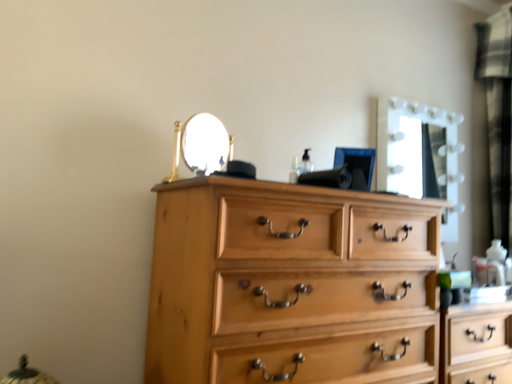
Question: Considering the positions of point (499, 228) and point (292, 251), is point (499, 228) closer or farther from the camera than point (292, 251)?

Choices:
 (A) closer
 (B) farther

Answer: (B)

Question: From their relative heights in the image, would you say black textured curtain at right is taller or shorter than natural wood chest of drawers at center?

Choices:
 (A) short
 (B) tall

Answer: (B)

Question: Based on their relative distances, which object is nearer to the black textured curtain at right?

Choices:
 (A) natural wood chest of drawers at center
 (B) white glossy mirror at upper right

Answer: (B)

Question: Which of these objects is positioned closest to the black textured curtain at right?

Choices:
 (A) white glossy mirror at upper right
 (B) natural wood chest of drawers at center

Answer: (A)